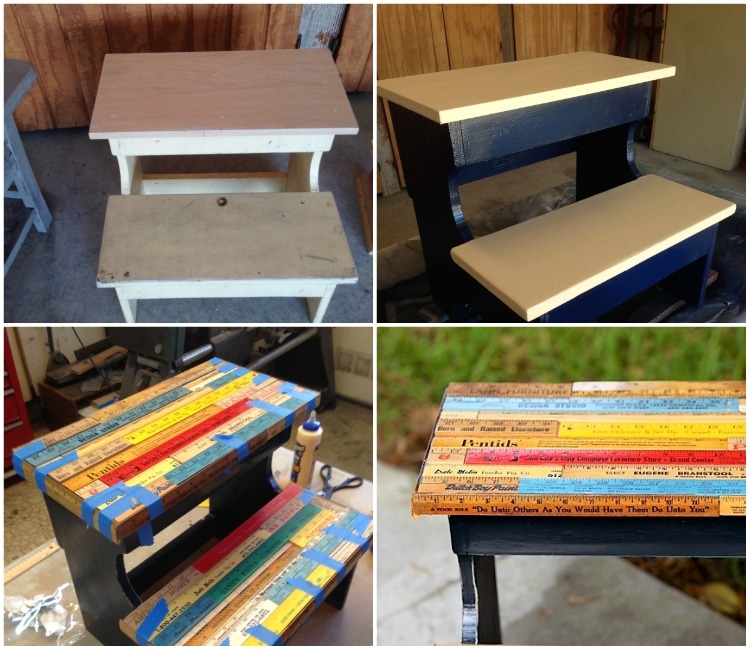
At what (x,y) coordinates should I click in order to perform the action: click on bench. Please return your answer as a coordinate pair (x, y). The height and width of the screenshot is (650, 750). Looking at the image, I should click on (214, 99), (493, 88), (166, 400), (553, 457).